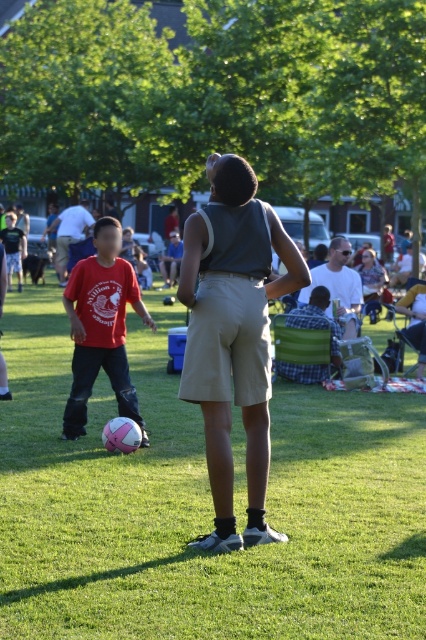
You are a photographer trying to capture a photo of the green grass at center and the matte red shirt at left. Based on their positions, which object should appear closer to the camera in the photo?

The green grass at center appears closer to the camera because it is positioned in front of the matte red shirt at left.

Looking at this image, you are a photographer trying to capture a photo of both the checkered fabric shirt at center and the red cotton shirt at left. Based on their heights, which one would you need to position lower in the frame to ensure both are fully visible?

The checkered fabric shirt at center has a lesser height compared to the red cotton shirt at left, so you should position the checkered fabric shirt at center lower in the frame to ensure both are fully visible.

Based on the photo, you are a photographer standing in the park. You want to take a picture of the green grass at center and the matte red shirt at left. Which object is positioned to the right side of the other?

The green grass at center is to the right of the matte red shirt at left according to the description.